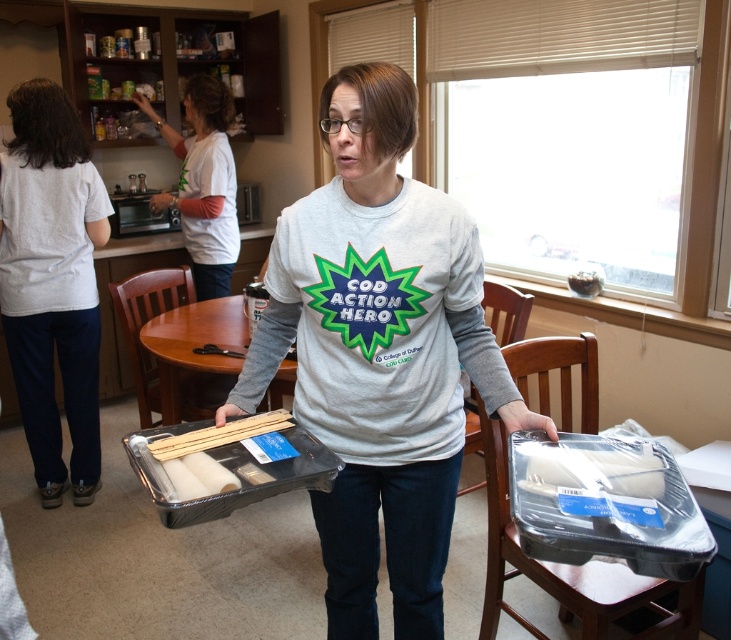
Question: Among these points, which one is farthest from the camera?

Choices:
 (A) (564, 468)
 (B) (193, 364)

Answer: (B)

Question: Which object appears farthest from the camera in this image?

Choices:
 (A) clear plastic bag at center
 (B) white t-shirt at center
 (C) gray matte t-shirt at center
 (D) brown wooden table at center

Answer: (B)

Question: Which object is farther from the camera taking this photo?

Choices:
 (A) brown wooden table at center
 (B) clear plastic bag at center
 (C) gray matte t-shirt at center
 (D) white t-shirt at center

Answer: (D)

Question: Is gray matte t-shirt at center in front of white cotton shirt at left?

Choices:
 (A) yes
 (B) no

Answer: (A)

Question: Does white t-shirt at center come behind clear plastic bag at center?

Choices:
 (A) no
 (B) yes

Answer: (B)

Question: Does gray matte t-shirt at center appear on the left side of brown wooden table at center?

Choices:
 (A) no
 (B) yes

Answer: (A)